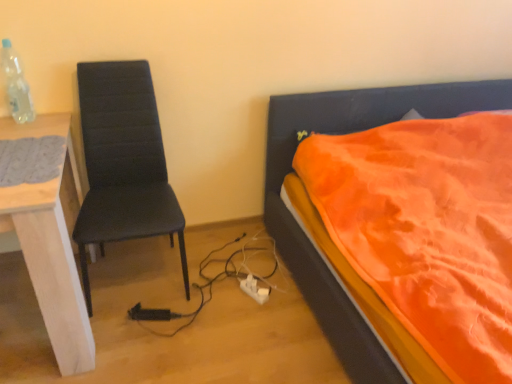
Image resolution: width=512 pixels, height=384 pixels. Find the location of `vacant location below matte black chair at left (from a real-world perspective)`. vacant location below matte black chair at left (from a real-world perspective) is located at coordinates (140, 276).